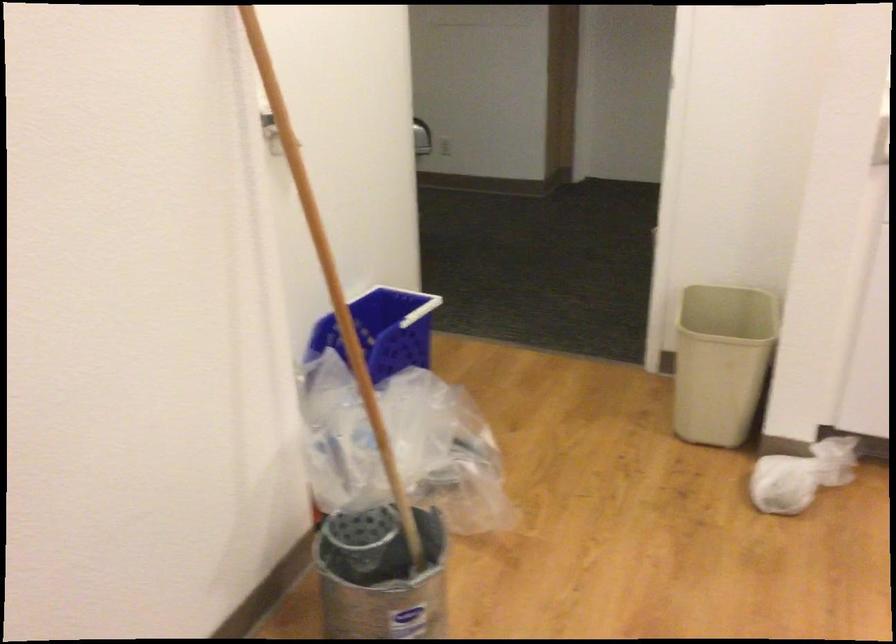
Where would you lift the metal bucket? Please return your answer as a coordinate pair (x, y).

(380, 576)